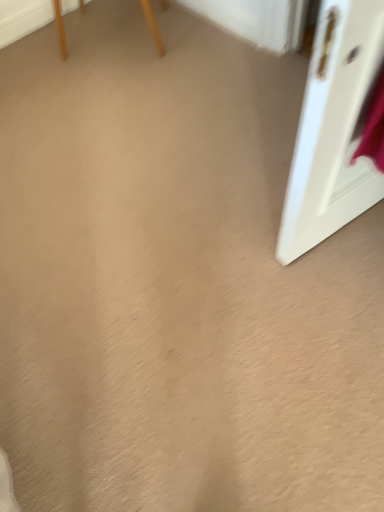
What do you see at coordinates (334, 128) in the screenshot? Image resolution: width=384 pixels, height=512 pixels. I see `white glossy door at right` at bounding box center [334, 128].

At what (x,y) coordinates should I click in order to perform the action: click on white glossy door at right. Please return your answer as a coordinate pair (x, y). This screenshot has width=384, height=512. Looking at the image, I should click on (334, 128).

At what (x,y) coordinates should I click in order to perform the action: click on white glossy door at right. Please return your answer as a coordinate pair (x, y). Image resolution: width=384 pixels, height=512 pixels. Looking at the image, I should click on (334, 128).